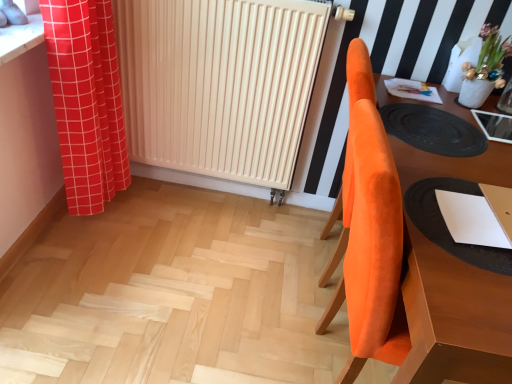
Question: Is white matte radiator at center smaller than red checkered curtain at left?

Choices:
 (A) yes
 (B) no

Answer: (A)

Question: Is white matte radiator at center positioned behind red checkered curtain at left?

Choices:
 (A) yes
 (B) no

Answer: (A)

Question: Does white matte radiator at center have a greater width compared to red checkered curtain at left?

Choices:
 (A) yes
 (B) no

Answer: (B)

Question: Is white matte radiator at center outside of red checkered curtain at left?

Choices:
 (A) no
 (B) yes

Answer: (B)

Question: Is white matte radiator at center to the left of red checkered curtain at left from the viewer's perspective?

Choices:
 (A) yes
 (B) no

Answer: (B)

Question: Is point (332, 340) positioned closer to the camera than point (174, 122)?

Choices:
 (A) closer
 (B) farther

Answer: (A)

Question: In terms of width, does natural wood stairs at center look wider or thinner when compared to white matte radiator at center?

Choices:
 (A) thin
 (B) wide

Answer: (B)

Question: Do you think natural wood stairs at center is within white matte radiator at center, or outside of it?

Choices:
 (A) outside
 (B) inside

Answer: (A)

Question: Is natural wood stairs at center in front of or behind white matte radiator at center in the image?

Choices:
 (A) front
 (B) behind

Answer: (A)

Question: Do you think white matte radiator at center is within black rubber mat at right, or outside of it?

Choices:
 (A) inside
 (B) outside

Answer: (B)

Question: Is white matte radiator at center bigger or smaller than black rubber mat at right?

Choices:
 (A) big
 (B) small

Answer: (A)

Question: From a real-world perspective, is white matte radiator at center above or below black rubber mat at right?

Choices:
 (A) below
 (B) above

Answer: (A)

Question: From the image's perspective, is white matte radiator at center located above or below black rubber mat at right?

Choices:
 (A) above
 (B) below

Answer: (A)

Question: From the image's perspective, is white matte radiator at center above or below red checkered curtain at left?

Choices:
 (A) below
 (B) above

Answer: (B)

Question: Is white matte radiator at center inside or outside of red checkered curtain at left?

Choices:
 (A) inside
 (B) outside

Answer: (B)